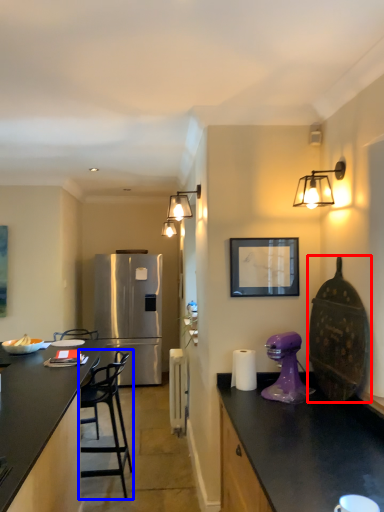
Question: Which object is closer to the camera taking this photo, appliance (highlighted by a red box) or chair (highlighted by a blue box)?

Choices:
 (A) appliance
 (B) chair

Answer: (A)